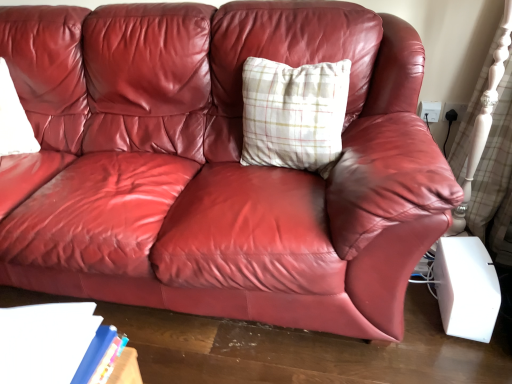
Question: Is blue hardcover book at lower left taller than white plaid pillow at center?

Choices:
 (A) no
 (B) yes

Answer: (A)

Question: Can you confirm if blue hardcover book at lower left is wider than white plaid pillow at center?

Choices:
 (A) yes
 (B) no

Answer: (B)

Question: Is blue hardcover book at lower left facing away from white plaid pillow at center?

Choices:
 (A) yes
 (B) no

Answer: (B)

Question: Considering the relative positions of blue hardcover book at lower left and white plaid pillow at center in the image provided, is blue hardcover book at lower left in front of white plaid pillow at center?

Choices:
 (A) yes
 (B) no

Answer: (A)

Question: Is blue hardcover book at lower left next to white plaid pillow at center and touching it?

Choices:
 (A) no
 (B) yes

Answer: (A)

Question: Can you confirm if blue hardcover book at lower left is positioned to the left of white plaid pillow at center?

Choices:
 (A) no
 (B) yes

Answer: (B)

Question: Considering the relative sizes of white plaid pillow at center and blue hardcover book at lower left in the image provided, is white plaid pillow at center bigger than blue hardcover book at lower left?

Choices:
 (A) no
 (B) yes

Answer: (B)

Question: Considering the relative sizes of white plaid pillow at center and blue hardcover book at lower left in the image provided, is white plaid pillow at center shorter than blue hardcover book at lower left?

Choices:
 (A) yes
 (B) no

Answer: (B)

Question: Can blue hardcover book at lower left be found inside white plaid pillow at center?

Choices:
 (A) yes
 (B) no

Answer: (B)

Question: Does white plaid pillow at center appear on the left side of blue hardcover book at lower left?

Choices:
 (A) yes
 (B) no

Answer: (B)

Question: Does white plaid pillow at center appear on the right side of blue hardcover book at lower left?

Choices:
 (A) yes
 (B) no

Answer: (A)

Question: Is white plaid pillow at center facing towards blue hardcover book at lower left?

Choices:
 (A) no
 (B) yes

Answer: (B)

Question: Is point (312, 94) positioned closer to the camera than point (11, 309)?

Choices:
 (A) farther
 (B) closer

Answer: (A)